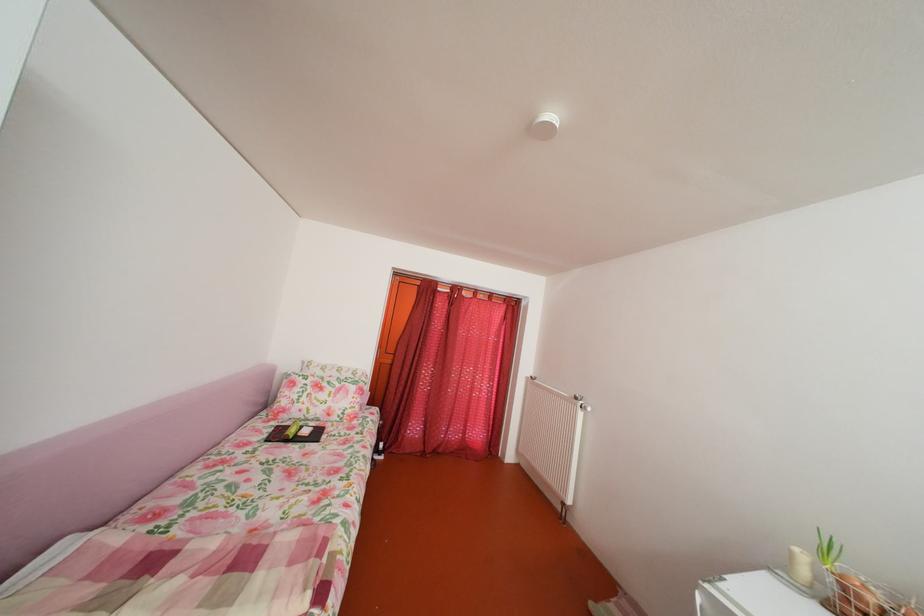
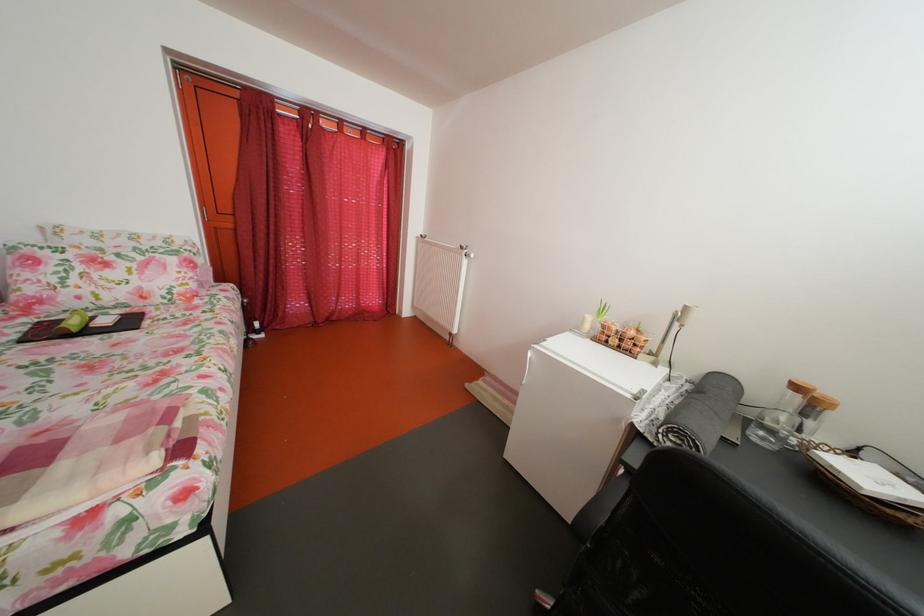
The point at (304, 438) is marked in the first image. Where is the corresponding point in the second image?

(83, 330)